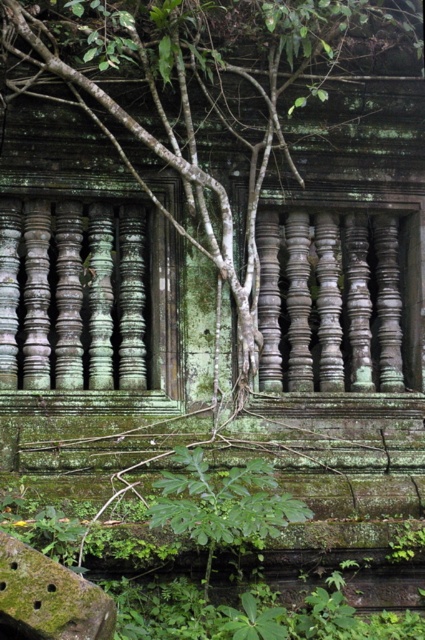
Can you confirm if green mossy tree at center is bigger than green leafy plant at lower center?

Correct, green mossy tree at center is larger in size than green leafy plant at lower center.

Who is more distant from viewer, (306, 52) or (243, 490)?

The point (306, 52) is more distant.

The image size is (425, 640). I want to click on green mossy tree at center, so click(201, 92).